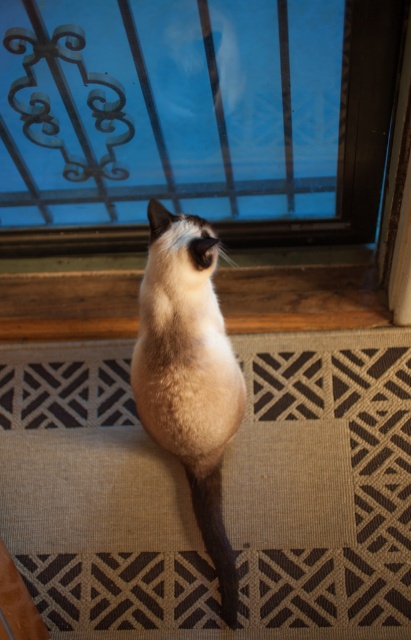
You are standing in a room and want to walk to the beige carpet at lower center. Which direction should you move relative to the transparent glass window at upper center?

You should move to the right of the transparent glass window at upper center to reach the beige carpet at lower center.